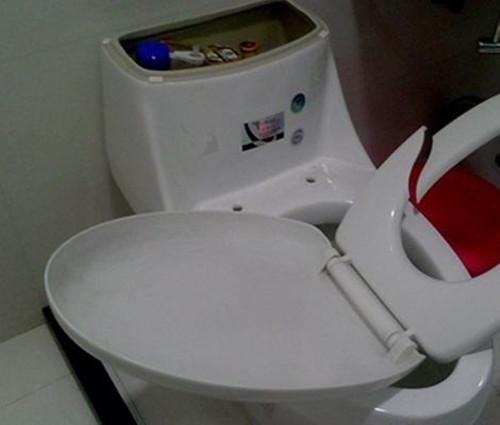
What are the coordinates of `holes for bolts for toilet` in the screenshot? It's located at (237, 208), (310, 182).